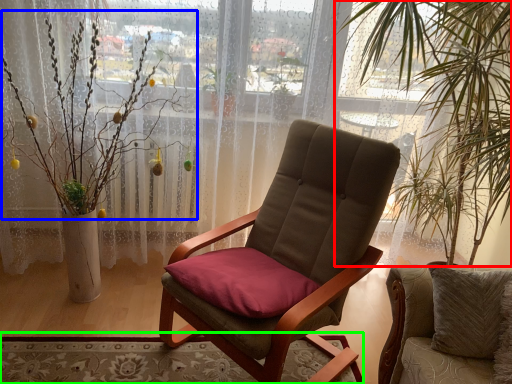
Question: Which object is the closest to the vegetation (highlighted by a red box)? Choose among these: floral arrangement (highlighted by a blue box) or mat (highlighted by a green box).

Choices:
 (A) floral arrangement
 (B) mat

Answer: (B)